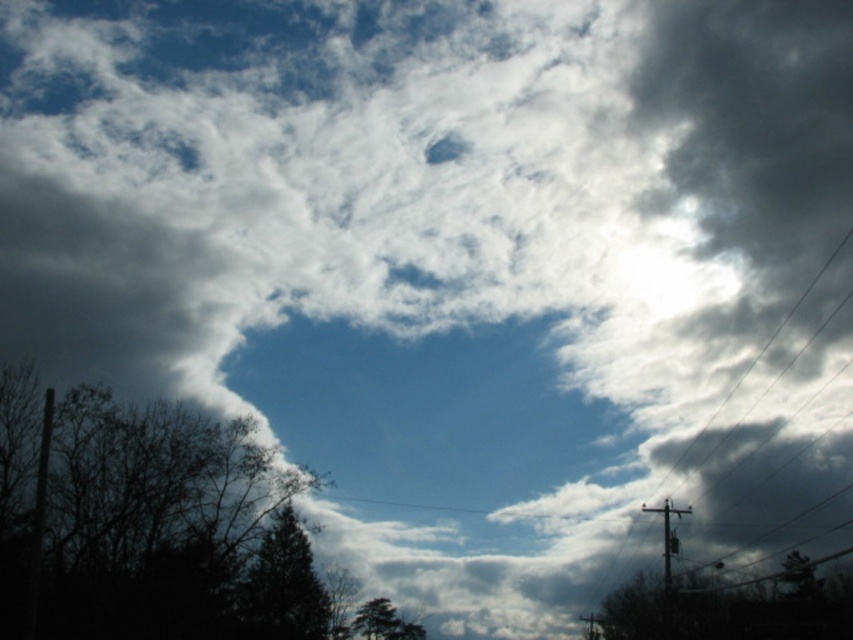
Question: Can you confirm if green leafy tree at lower right is positioned above green matte tree at lower center?

Choices:
 (A) no
 (B) yes

Answer: (B)

Question: Which point appears farthest from the camera in this image?

Choices:
 (A) (657, 605)
 (B) (238, 604)

Answer: (A)

Question: Does dark green leafy tree at lower left have a greater width compared to green matte tree at lower left?

Choices:
 (A) yes
 (B) no

Answer: (A)

Question: Which of these objects is positioned farthest from the green leafy tree at lower right?

Choices:
 (A) dark green leafy tree at lower left
 (B) green matte tree at lower center

Answer: (A)

Question: Which object is the farthest from the dark green leafy tree at lower left?

Choices:
 (A) green leafy tree at lower right
 (B) green matte tree at lower center
 (C) green matte tree at lower left

Answer: (A)

Question: Is dark green leafy tree at lower left to the right of green matte tree at lower left from the viewer's perspective?

Choices:
 (A) yes
 (B) no

Answer: (B)